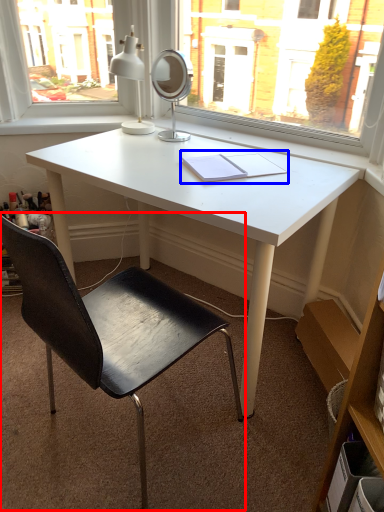
Question: Which object appears farthest to the camera in this image, chair (highlighted by a red box) or notebook (highlighted by a blue box)?

Choices:
 (A) chair
 (B) notebook

Answer: (B)